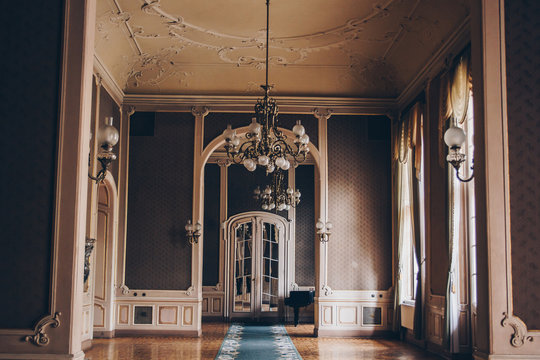
This screenshot has width=540, height=360. I want to click on brown squares on bottom of walls, so click(x=372, y=316), click(x=140, y=313).